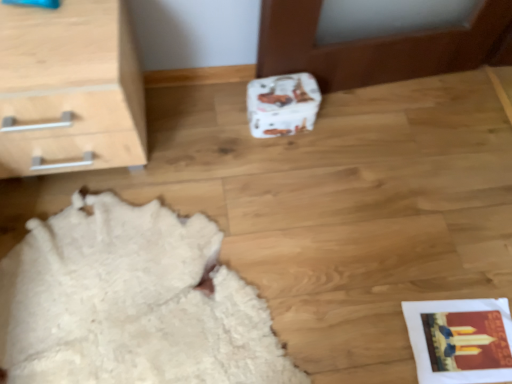
Where is `white fluffy rug at lower left`? This screenshot has height=384, width=512. white fluffy rug at lower left is located at coordinates (131, 302).

Considering the relative sizes of white paper shoe box at center and white fluffy rug at lower left in the image provided, is white paper shoe box at center thinner than white fluffy rug at lower left?

Yes, white paper shoe box at center is thinner than white fluffy rug at lower left.

Which is closer to the camera, (258, 103) or (170, 350)?

The point (170, 350) is in front.

From the image's perspective, relative to white fluffy rug at lower left, is white paper shoe box at center above or below?

From the image's perspective, white paper shoe box at center appears above white fluffy rug at lower left.

Is light wood/texture chest of drawers at upper left oriented towards white paper shoe box at center?

No, light wood/texture chest of drawers at upper left is not aimed at white paper shoe box at center.

Which is less distant, (52, 74) or (261, 92)?

Point (52, 74)

In the image, is light wood/texture chest of drawers at upper left positioned in front of or behind white paper shoe box at center?

In the image, light wood/texture chest of drawers at upper left appears in front of white paper shoe box at center.

From the image's perspective, is white fluffy rug at lower left located above light wood/texture chest of drawers at upper left?

Result: No, from the image's perspective, white fluffy rug at lower left is not over light wood/texture chest of drawers at upper left.

Can you tell me how much white fluffy rug at lower left and light wood/texture chest of drawers at upper left differ in facing direction?

white fluffy rug at lower left and light wood/texture chest of drawers at upper left are facing 97.4 degrees away from each other.

Considering the relative sizes of white fluffy rug at lower left and light wood/texture chest of drawers at upper left in the image provided, is white fluffy rug at lower left thinner than light wood/texture chest of drawers at upper left?

No, white fluffy rug at lower left is not thinner than light wood/texture chest of drawers at upper left.

Considering the positions of objects white fluffy rug at lower left and light wood/texture chest of drawers at upper left in the image provided, who is in front, white fluffy rug at lower left or light wood/texture chest of drawers at upper left?

light wood/texture chest of drawers at upper left is in front.

How much distance is there between light wood/texture chest of drawers at upper left and white fluffy rug at lower left?

The distance of light wood/texture chest of drawers at upper left from white fluffy rug at lower left is 14.62 inches.

Is light wood/texture chest of drawers at upper left not within white fluffy rug at lower left?

Indeed, light wood/texture chest of drawers at upper left is completely outside white fluffy rug at lower left.

Between light wood/texture chest of drawers at upper left and white fluffy rug at lower left, which one has more height?

Standing taller between the two is light wood/texture chest of drawers at upper left.

You are a GUI agent. You are given a task and a screenshot of the screen. Output one action in this format:
    pyautogui.click(x=<x>, y=<y>)
    Task: Click on the blanket that appears behind the light wood/texture chest of drawers at upper left
    This screenshot has width=512, height=384.
    Given the screenshot: What is the action you would take?
    pyautogui.click(x=131, y=302)

From the image's perspective, between white fluffy rug at lower left and white paper shoe box at center, which one is located above?

white paper shoe box at center is shown above in the image.

Does white fluffy rug at lower left have a lesser width compared to white paper shoe box at center?

No.

From their relative heights in the image, would you say white fluffy rug at lower left is taller or shorter than white paper shoe box at center?

Clearly, white fluffy rug at lower left is shorter compared to white paper shoe box at center.

Is there a large distance between white fluffy rug at lower left and white paper shoe box at center?

No, white fluffy rug at lower left is not far from white paper shoe box at center.

How different are the orientations of white paper shoe box at center and light wood/texture chest of drawers at upper left in degrees?

0.775 degrees.

Is white paper shoe box at center surrounding light wood/texture chest of drawers at upper left?

Actually, light wood/texture chest of drawers at upper left is outside white paper shoe box at center.

Is white paper shoe box at center thinner than light wood/texture chest of drawers at upper left?

Yes, white paper shoe box at center is thinner than light wood/texture chest of drawers at upper left.

Image resolution: width=512 pixels, height=384 pixels. Identify the location of shoe box that appears above the white fluffy rug at lower left (from a real-world perspective). (282, 104).

Identify the location of the chest of drawers in front of the white paper shoe box at center. The height and width of the screenshot is (384, 512). (69, 89).

Considering their positions, is white fluffy rug at lower left positioned further to light wood/texture chest of drawers at upper left than white paper shoe box at center?

white paper shoe box at center is further to light wood/texture chest of drawers at upper left.

Looking at the image, which one is located further to white fluffy rug at lower left, white paper shoe box at center or light wood/texture chest of drawers at upper left?

white paper shoe box at center is further to white fluffy rug at lower left.

Based on their spatial positions, is white paper shoe box at center or white fluffy rug at lower left further from light wood/texture chest of drawers at upper left?

white paper shoe box at center is further to light wood/texture chest of drawers at upper left.

Which object lies further to the anchor point white fluffy rug at lower left, light wood/texture chest of drawers at upper left or white paper shoe box at center?

Among the two, white paper shoe box at center is located further to white fluffy rug at lower left.

Based on their spatial positions, is white fluffy rug at lower left or light wood/texture chest of drawers at upper left further from white paper shoe box at center?

white fluffy rug at lower left is positioned further to the anchor white paper shoe box at center.

When comparing their distances from white paper shoe box at center, does light wood/texture chest of drawers at upper left or white fluffy rug at lower left seem closer?

The object closer to white paper shoe box at center is light wood/texture chest of drawers at upper left.

Where is `blanket between light wood/texture chest of drawers at upper left and white paper shoe box at center in the horizontal direction`? blanket between light wood/texture chest of drawers at upper left and white paper shoe box at center in the horizontal direction is located at coordinates (131, 302).